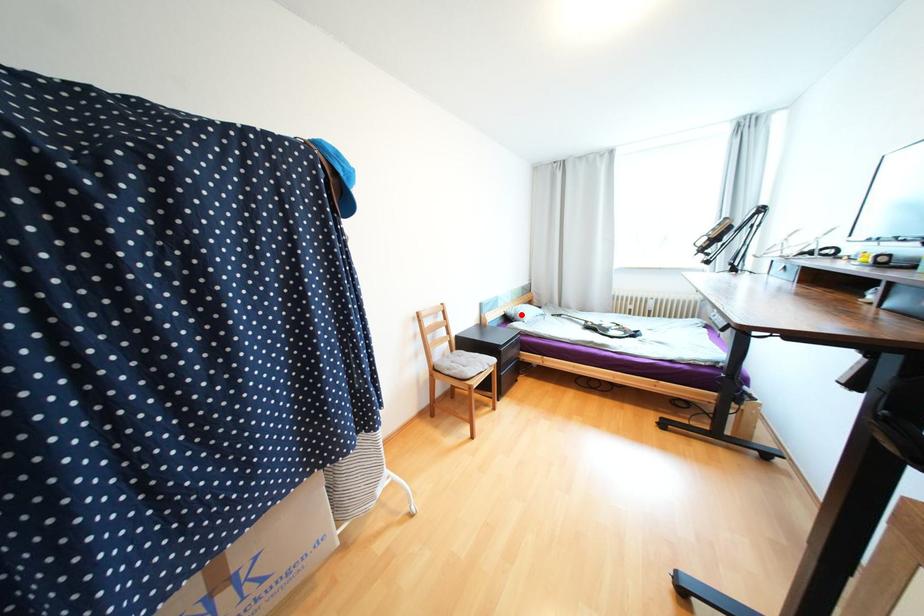
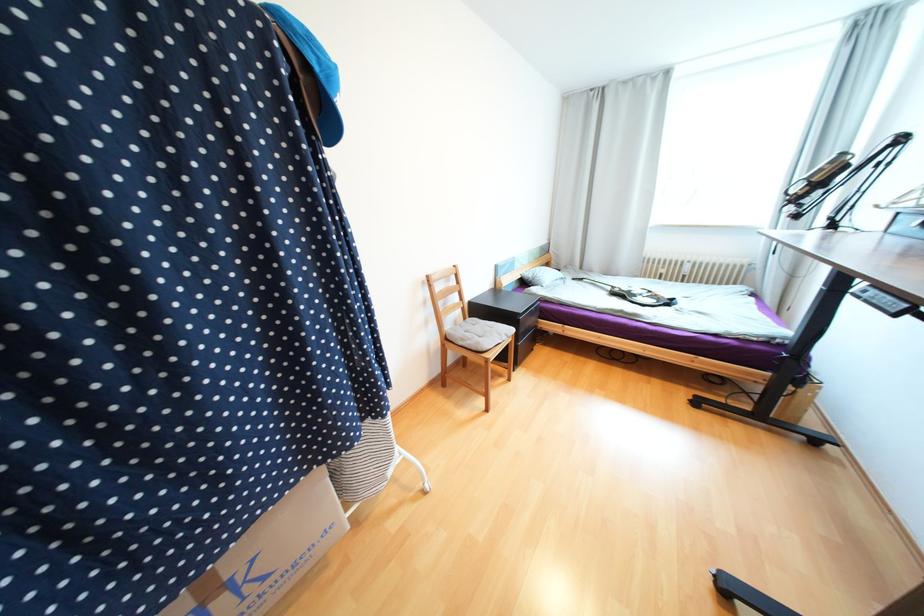
Question: I am providing you with two images of the same scene from different viewpoints. In image1, a red point is highlighted. Considering the same 3D point in image2, which of the following is correct?

Choices:
 (A) It is closer
 (B) It is farther

Answer: (A)